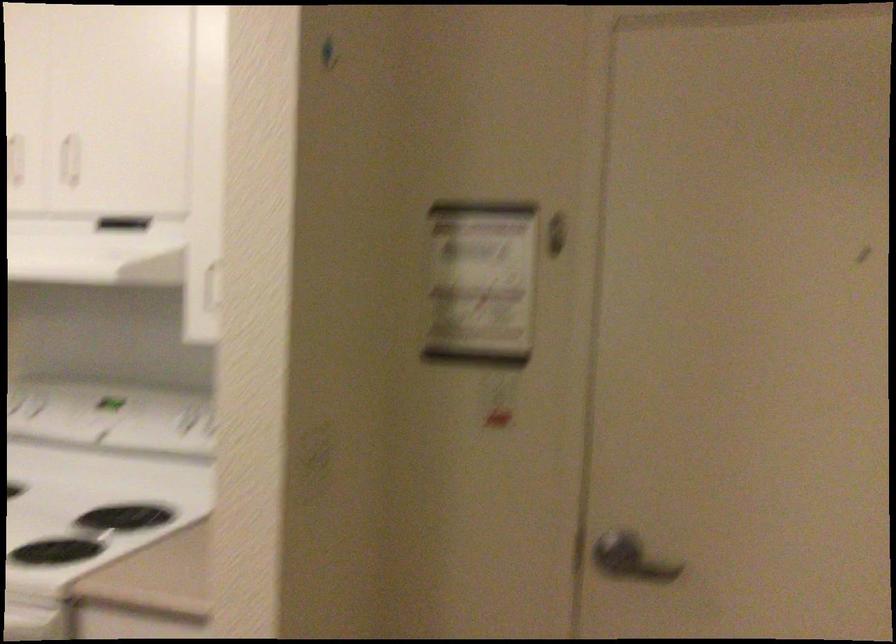
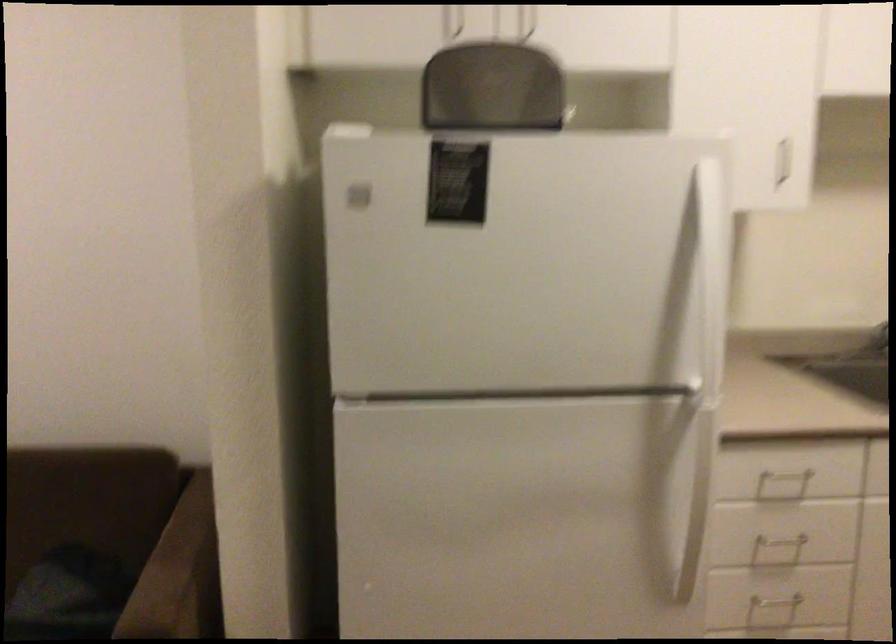
Question: The camera is either moving clockwise (left) or counter-clockwise (right) around the object. The first image is from the beginning of the video and the second image is from the end. Is the camera moving left or right when shooting the video?

Choices:
 (A) Left
 (B) Right

Answer: (B)